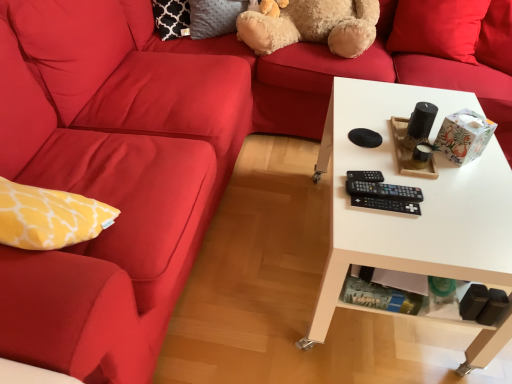
Locate an element on the screen. free space in front of black plastic remote at center, which is the second control from front to back is located at coordinates (397, 228).